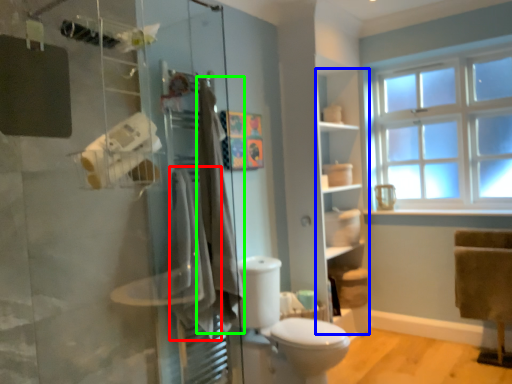
Question: Which object is the farthest from bath towel (highlighted by a red box)? Choose among these: shelf (highlighted by a blue box) or bath towel (highlighted by a green box).

Choices:
 (A) shelf
 (B) bath towel

Answer: (A)